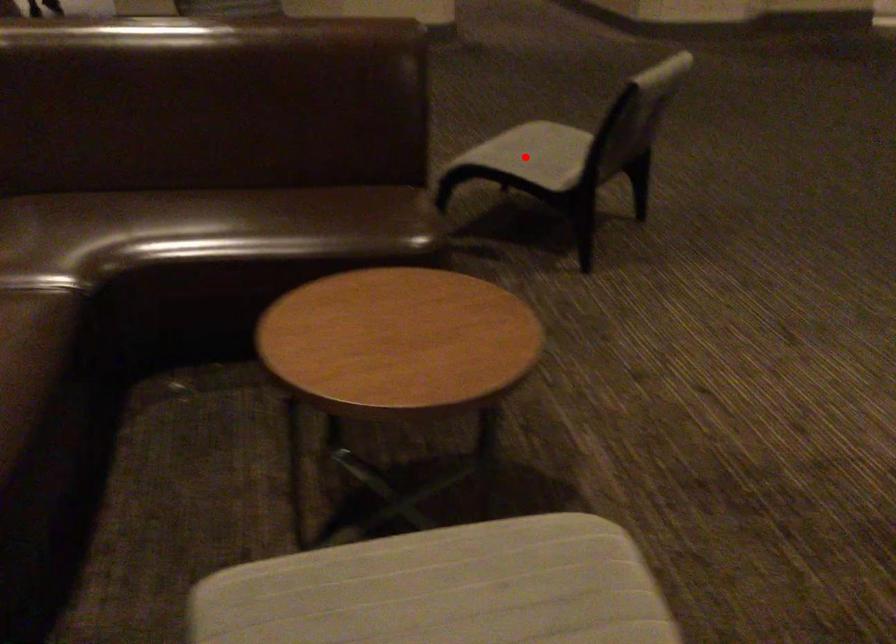
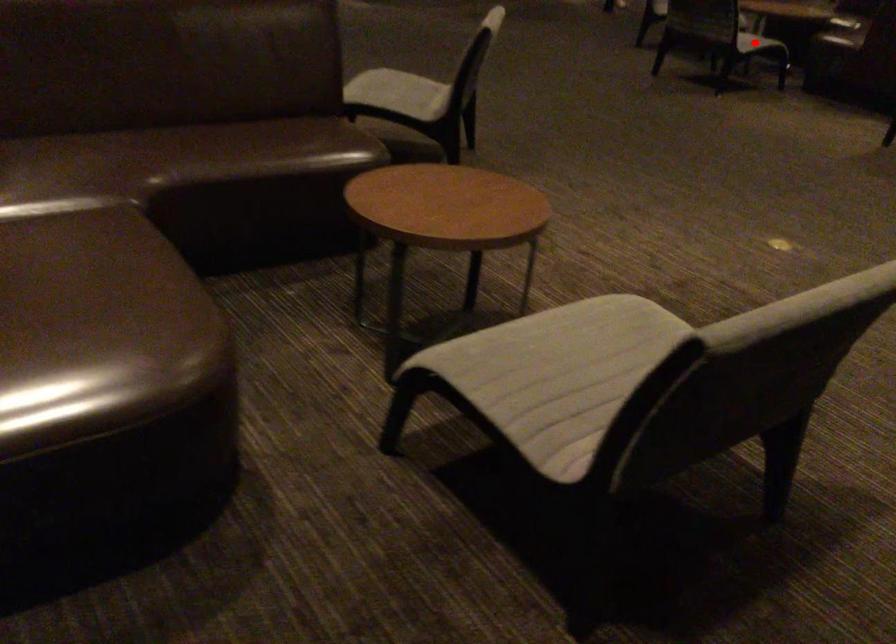
I am providing you with two images of the same scene from different viewpoints. A red point is marked on the first image and another point is marked on the second image. Does the point marked in image1 correspond to the same location as the one in image2?

No